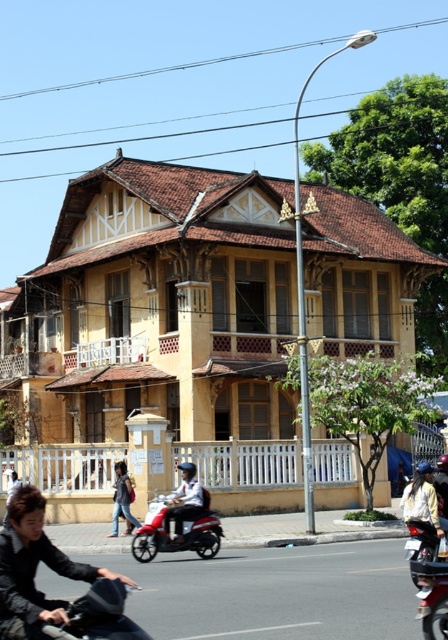
Looking at this image, you are a delivery person who needs to park your motorcycle between the matte black motorcycle at lower left and the light brown leather jacket at lower center. Can you fit your motorcycle there if your motorcycle is 1.8 meters wide?

The matte black motorcycle at lower left is wider than the light brown leather jacket at lower center. Since the space between them is determined by the narrower object, the light brown leather jacket at lower center, which is narrower than your motorcycle, you cannot fit your motorcycle there.

You are standing at the front gate of the two story building and want to park your metallic red motorcycle at lower right. Where exactly should you place it?

The metallic red motorcycle at lower right should be placed at point (427, 577) as specified in the coordinates.

You are standing in front of the two story building and want to take a photo. You notice two points marked on the image. The first point is at coordinate point (30, 515) and the second is at point (124, 493). Which point will appear closer to you in the photo?

Point (30, 515) is closer to the camera than point (124, 493), so it will appear closer to you in the photo.